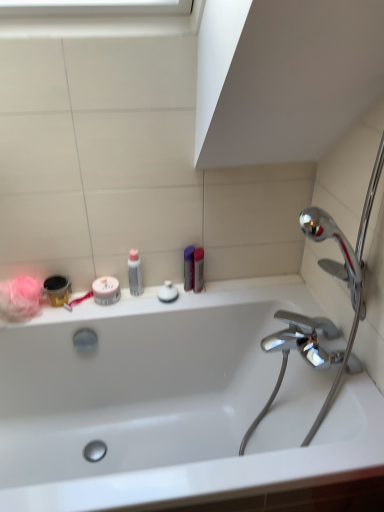
Question: Is white matte jar at center, which ranks as the 2th mouthwash in right-to-left order, to the right of translucent plastic bottle at upper center, which appears as the 3th toiletry when viewed from the right, from the viewer's perspective?

Choices:
 (A) yes
 (B) no

Answer: (B)

Question: Considering the relative sizes of white matte jar at center, marked as the first mouthwash in a left-to-right arrangement, and translucent plastic bottle at upper center, which appears as the 3th toiletry when viewed from the right, in the image provided, is white matte jar at center, marked as the first mouthwash in a left-to-right arrangement, thinner than translucent plastic bottle at upper center, which appears as the 3th toiletry when viewed from the right,?

Choices:
 (A) no
 (B) yes

Answer: (A)

Question: Considering the relative sizes of white matte jar at center, which ranks as the 2th mouthwash in right-to-left order, and translucent plastic bottle at upper center, which appears as the 3th toiletry when viewed from the right, in the image provided, is white matte jar at center, which ranks as the 2th mouthwash in right-to-left order, taller than translucent plastic bottle at upper center, which appears as the 3th toiletry when viewed from the right,?

Choices:
 (A) no
 (B) yes

Answer: (A)

Question: Is white matte jar at center, which ranks as the 2th mouthwash in right-to-left order, wider than translucent plastic bottle at upper center, the 1th toiletry positioned from the left?

Choices:
 (A) yes
 (B) no

Answer: (A)

Question: Does white matte jar at center, which ranks as the 2th mouthwash in right-to-left order, have a smaller size compared to translucent plastic bottle at upper center, the 1th toiletry positioned from the left?

Choices:
 (A) yes
 (B) no

Answer: (B)

Question: Is metallic silver mouthwash at right, marked as the first mouthwash in a right-to-left arrangement, in front of or behind white matte jar at center, marked as the first mouthwash in a left-to-right arrangement, in the image?

Choices:
 (A) front
 (B) behind

Answer: (B)

Question: Is metallic silver mouthwash at right, marked as the first mouthwash in a right-to-left arrangement, taller or shorter than white matte jar at center, marked as the first mouthwash in a left-to-right arrangement?

Choices:
 (A) tall
 (B) short

Answer: (A)

Question: From the image's perspective, is metallic silver mouthwash at right, acting as the 2th mouthwash starting from the left, above or below white matte jar at center, which ranks as the 2th mouthwash in right-to-left order?

Choices:
 (A) below
 (B) above

Answer: (B)

Question: Based on their sizes in the image, would you say metallic silver mouthwash at right, marked as the first mouthwash in a right-to-left arrangement, is bigger or smaller than white matte jar at center, marked as the first mouthwash in a left-to-right arrangement?

Choices:
 (A) big
 (B) small

Answer: (A)

Question: Would you say white glossy soap at center, placed as the 2th toiletry when sorted from left to right, is to the left or to the right of metallic silver toothbrush at left in the picture?

Choices:
 (A) right
 (B) left

Answer: (A)

Question: Is white glossy soap at center, the second toiletry positioned from the right, situated inside metallic silver toothbrush at left or outside?

Choices:
 (A) inside
 (B) outside

Answer: (B)

Question: In the image, is white glossy soap at center, the second toiletry positioned from the right, positioned in front of or behind metallic silver toothbrush at left?

Choices:
 (A) front
 (B) behind

Answer: (B)

Question: Looking at their shapes, would you say white glossy soap at center, placed as the 2th toiletry when sorted from left to right, is wider or thinner than metallic silver toothbrush at left?

Choices:
 (A) wide
 (B) thin

Answer: (B)

Question: From a real-world perspective, is metallic silver toothbrush at left positioned above or below white matte jar at center, which ranks as the 2th mouthwash in right-to-left order?

Choices:
 (A) above
 (B) below

Answer: (B)

Question: Is metallic silver toothbrush at left inside or outside of white matte jar at center, marked as the first mouthwash in a left-to-right arrangement?

Choices:
 (A) inside
 (B) outside

Answer: (B)